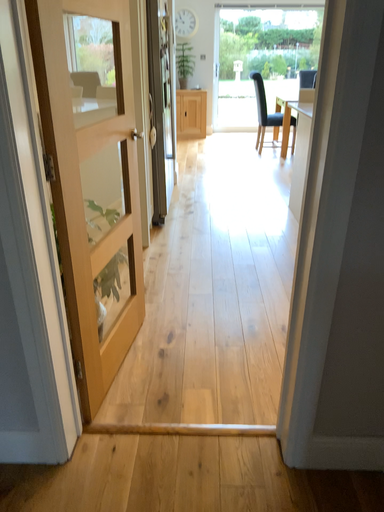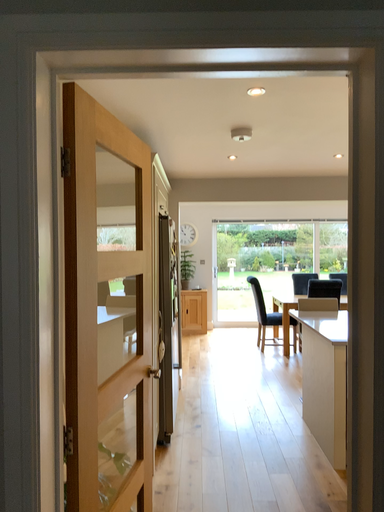
Question: Which way did the camera rotate in the video?

Choices:
 (A) rotated downward
 (B) rotated upward

Answer: (B)